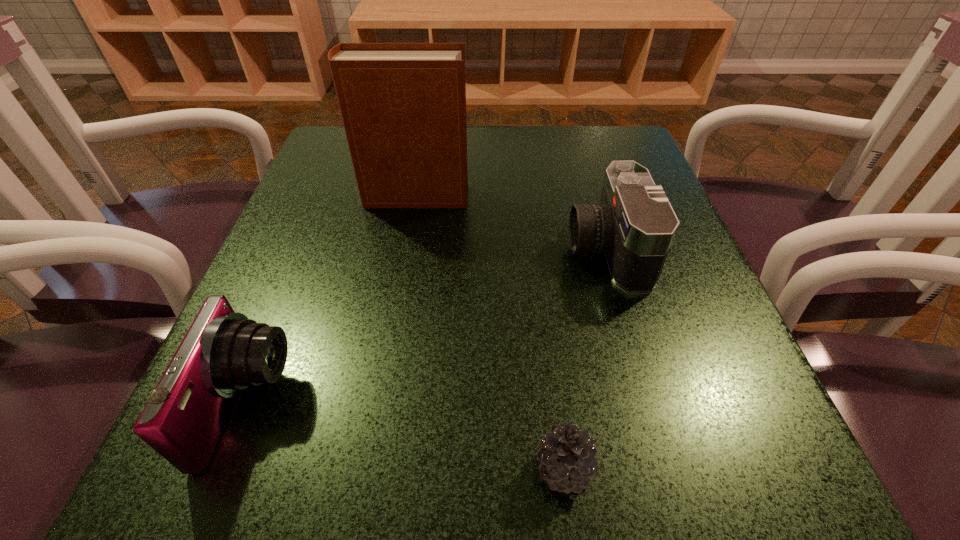
The height and width of the screenshot is (540, 960). What are the coordinates of `hardback book` in the screenshot? It's located at (403, 105).

Where is `the tallest object`? This screenshot has width=960, height=540. the tallest object is located at coordinates (403, 105).

What are the coordinates of `the third nearest object` in the screenshot? It's located at (634, 224).

Identify the location of the rightmost object. The width and height of the screenshot is (960, 540). (634, 224).

Find the location of a particular element. the nearer camera is located at coordinates (223, 352).

I want to click on the leftmost object, so click(223, 352).

I want to click on the second object from right to left, so click(567, 456).

Where is `pinecone`? This screenshot has width=960, height=540. pinecone is located at coordinates (567, 456).

Identify the location of blank area located 0.310m on the open cover of the hardback book. The image size is (960, 540). (621, 197).

The width and height of the screenshot is (960, 540). In order to click on blank space located 0.340m on the front-facing side of the right camera in this screenshot , I will do `click(376, 249)`.